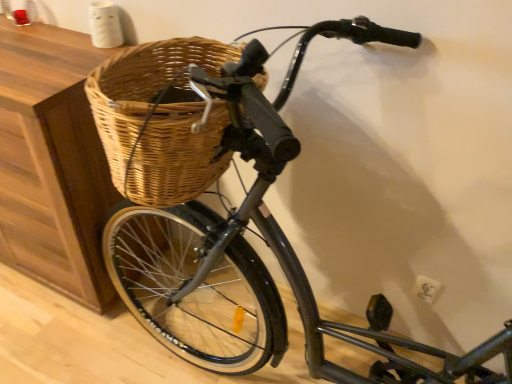
Find the location of a particular element. The width and height of the screenshot is (512, 384). wooden cabinet at left is located at coordinates (52, 162).

What do you see at coordinates (52, 162) in the screenshot? I see `wooden cabinet at left` at bounding box center [52, 162].

Identify the location of wooden cabinet at left. The width and height of the screenshot is (512, 384). (52, 162).